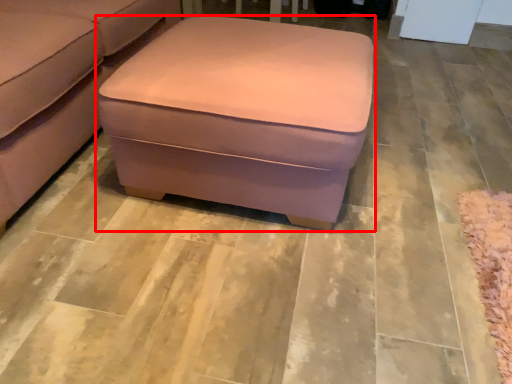
Question: From the image's perspective, what is the correct spatial positioning of table (annotated by the red box) in reference to studio couch?

Choices:
 (A) above
 (B) below

Answer: (B)